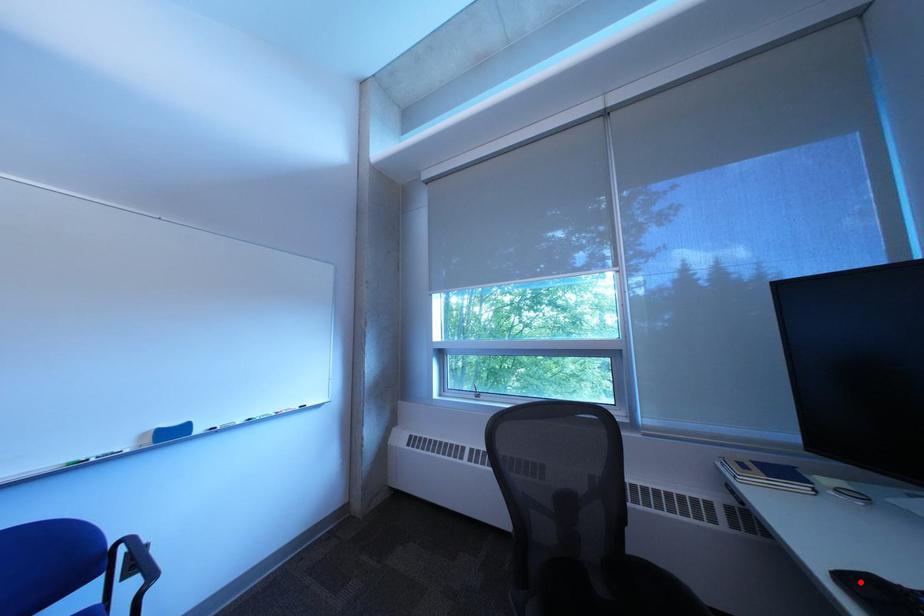
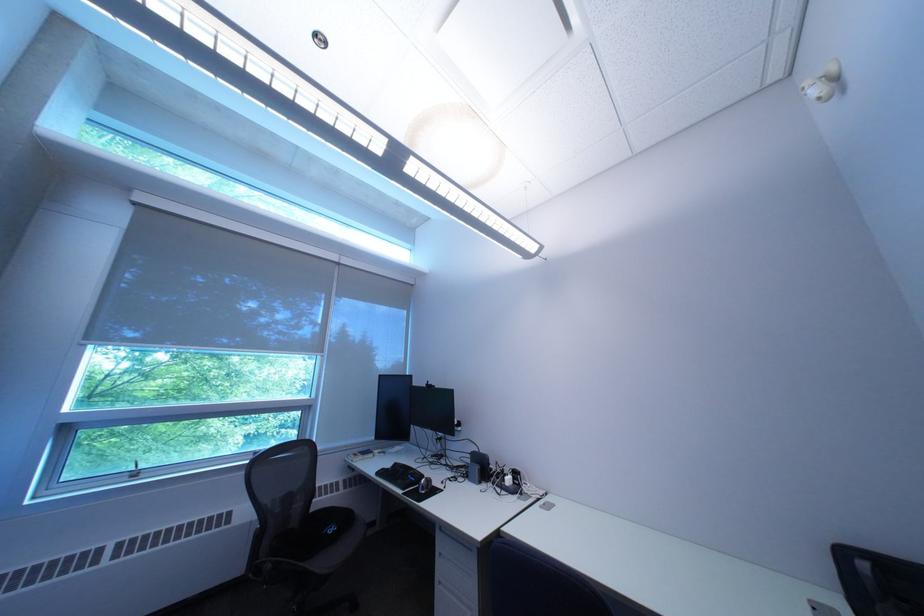
Locate, in the second image, the point that corresponds to the highlighted location in the first image.

(393, 475)